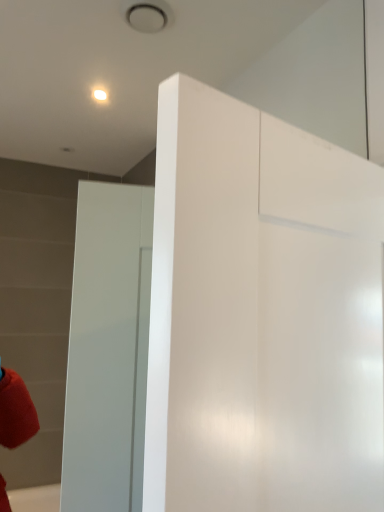
Where is `white glossy dresser at center`? white glossy dresser at center is located at coordinates (261, 315).

What is the approximate width of white glossy dresser at center?

white glossy dresser at center is 5.85 inches in width.

The image size is (384, 512). Describe the element at coordinates (261, 315) in the screenshot. I see `white glossy dresser at center` at that location.

I want to click on white glossy dresser at center, so click(261, 315).